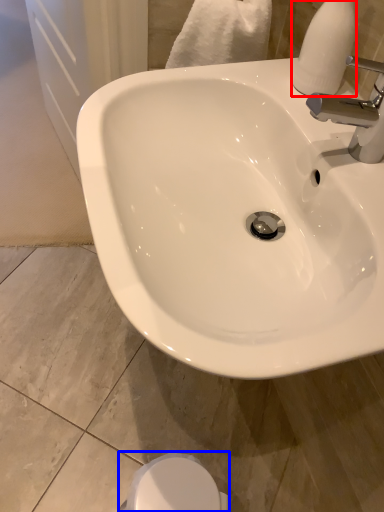
Question: Among these objects, which one is nearest to the camera, soap dispenser (highlighted by a red box) or bidet (highlighted by a blue box)?

Choices:
 (A) soap dispenser
 (B) bidet

Answer: (A)